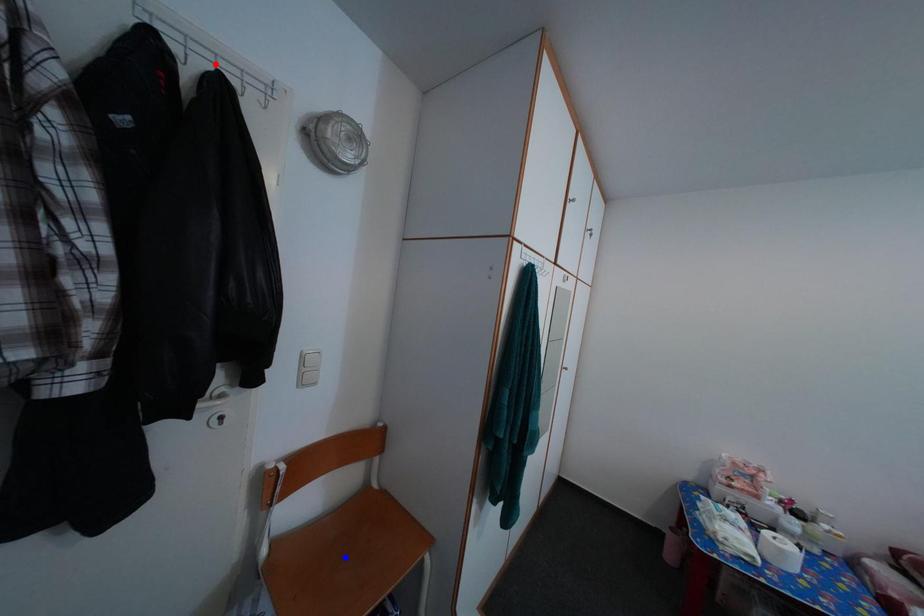
Question: In the image, two points are highlighted. Which point is nearer to the camera? Reply with the corresponding letter.

Choices:
 (A) blue point
 (B) red point

Answer: (B)